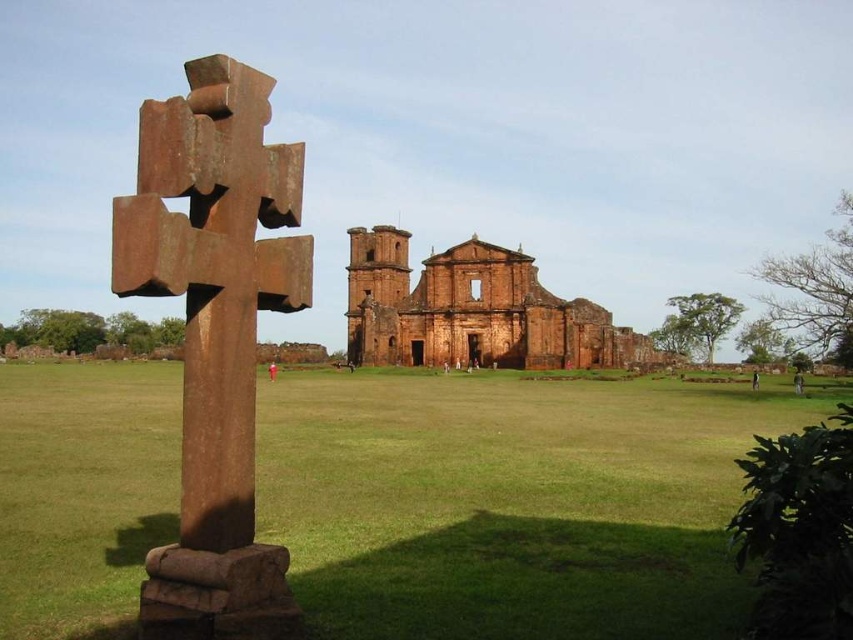
Between rusty metal cross at left and brown brick ruins at center, which one has more height?

Standing taller between the two is rusty metal cross at left.

Who is more forward, (242, 305) or (386, 236)?

Point (242, 305) is in front.

This screenshot has height=640, width=853. Identify the location of rusty metal cross at left. (215, 336).

Between point (482, 595) and point (397, 305), which one is positioned in front?

Point (482, 595)

Who is taller, green grass at center or brown brick ruins at center?

Standing taller between the two is brown brick ruins at center.

Is point (477, 490) positioned in front of point (476, 285)?

Yes, point (477, 490) is in front of point (476, 285).

Locate an element on the screen. Image resolution: width=853 pixels, height=640 pixels. green grass at center is located at coordinates (514, 500).

Where is `green grass at center`? green grass at center is located at coordinates (514, 500).

Which is behind, point (477, 515) or point (263, 209)?

Point (477, 515)

What do you see at coordinates (514, 500) in the screenshot?
I see `green grass at center` at bounding box center [514, 500].

Where is `green grass at center`? The height and width of the screenshot is (640, 853). green grass at center is located at coordinates (514, 500).